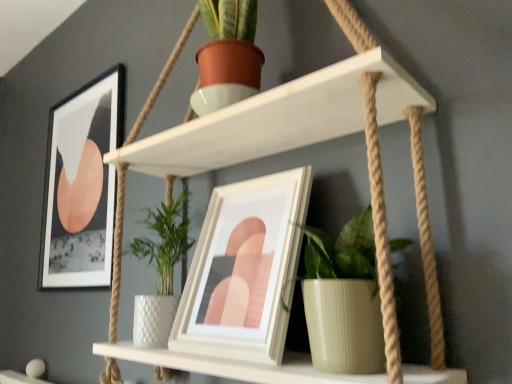
Question: From the image's perspective, is white glossy picture frame at center, which appears as the 2th picture frame when viewed from the left, on top of white matte shelf at upper center?

Choices:
 (A) no
 (B) yes

Answer: (A)

Question: Is white glossy picture frame at center, which ranks as the second picture frame in back-to-front order, outside white matte shelf at upper center?

Choices:
 (A) no
 (B) yes

Answer: (A)

Question: Can you confirm if white glossy picture frame at center, which is the first picture frame in right-to-left order, is wider than white matte shelf at upper center?

Choices:
 (A) yes
 (B) no

Answer: (B)

Question: Is white glossy picture frame at center, which appears as the 2th picture frame when viewed from the left, taller than white matte shelf at upper center?

Choices:
 (A) yes
 (B) no

Answer: (B)

Question: Is white matte shelf at upper center surrounded by white glossy picture frame at center, which ranks as the second picture frame in back-to-front order?

Choices:
 (A) yes
 (B) no

Answer: (B)

Question: Does white glossy picture frame at center, which appears as the 2th picture frame when viewed from the left, appear on the left side of white matte shelf at upper center?

Choices:
 (A) no
 (B) yes

Answer: (A)

Question: Is green ribbed pot at center positioned beyond the bounds of white matte shelf at upper center?

Choices:
 (A) no
 (B) yes

Answer: (A)

Question: Is green ribbed pot at center positioned with its back to white matte shelf at upper center?

Choices:
 (A) no
 (B) yes

Answer: (B)

Question: Considering the relative sizes of green ribbed pot at center and white matte shelf at upper center in the image provided, is green ribbed pot at center wider than white matte shelf at upper center?

Choices:
 (A) no
 (B) yes

Answer: (A)

Question: Can you confirm if green ribbed pot at center is smaller than white matte shelf at upper center?

Choices:
 (A) yes
 (B) no

Answer: (A)

Question: Considering the relative sizes of green ribbed pot at center and white matte shelf at upper center in the image provided, is green ribbed pot at center taller than white matte shelf at upper center?

Choices:
 (A) yes
 (B) no

Answer: (B)

Question: Can you confirm if green ribbed pot at center is shorter than white matte shelf at upper center?

Choices:
 (A) no
 (B) yes

Answer: (B)

Question: Is white matte shelf at upper center aimed at matte black picture frame at upper left, marked as the 2th picture frame in a right-to-left arrangement?

Choices:
 (A) no
 (B) yes

Answer: (A)